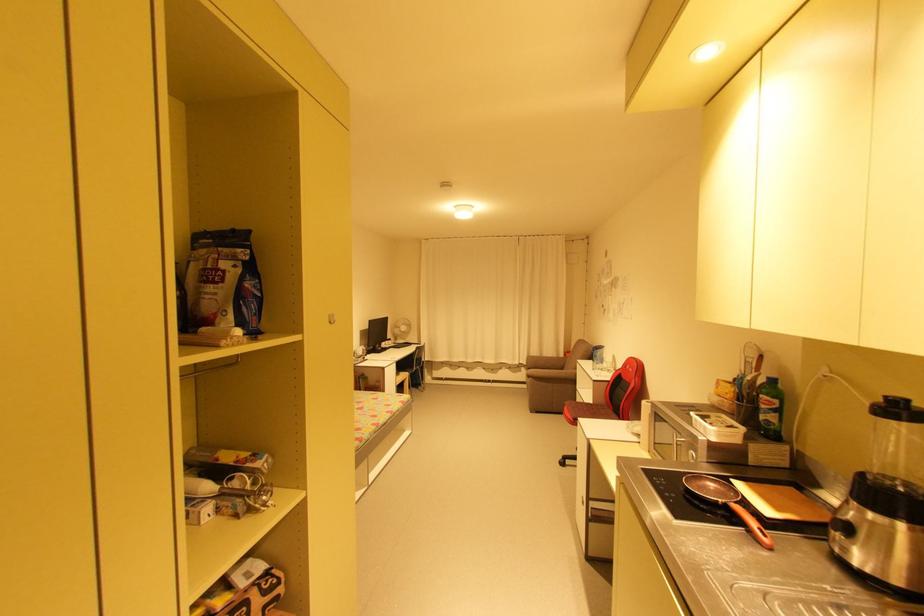
At what (x,y) coordinates should I click in order to perform the action: click on sofa armrest. Please return your answer as a coordinate pair (x, y). The image size is (924, 616). Looking at the image, I should click on (553, 379).